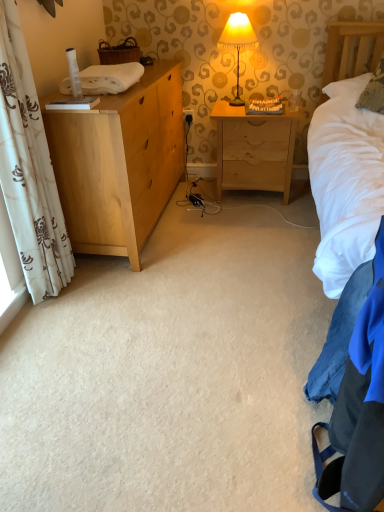
Question: Is light wood chest of drawers at left oriented away from textured beige pillow at upper right?

Choices:
 (A) yes
 (B) no

Answer: (B)

Question: Does light wood chest of drawers at left lie in front of textured beige pillow at upper right?

Choices:
 (A) yes
 (B) no

Answer: (A)

Question: Can you confirm if light wood chest of drawers at left is wider than textured beige pillow at upper right?

Choices:
 (A) yes
 (B) no

Answer: (A)

Question: Does light wood chest of drawers at left have a greater height compared to textured beige pillow at upper right?

Choices:
 (A) yes
 (B) no

Answer: (A)

Question: Is light wood chest of drawers at left in contact with textured beige pillow at upper right?

Choices:
 (A) yes
 (B) no

Answer: (B)

Question: Based on their sizes in the image, would you say yellow fabric lampshade at upper center is bigger or smaller than white floral fabric curtain at left?

Choices:
 (A) small
 (B) big

Answer: (A)

Question: Looking at their shapes, would you say yellow fabric lampshade at upper center is wider or thinner than white floral fabric curtain at left?

Choices:
 (A) wide
 (B) thin

Answer: (A)

Question: Considering their positions, is yellow fabric lampshade at upper center located in front of or behind white floral fabric curtain at left?

Choices:
 (A) front
 (B) behind

Answer: (B)

Question: Is point (228, 35) positioned closer to the camera than point (24, 166)?

Choices:
 (A) closer
 (B) farther

Answer: (B)

Question: Considering their positions, is yellow fabric lampshade at upper center located in front of or behind textured beige pillow at upper right?

Choices:
 (A) behind
 (B) front

Answer: (A)

Question: In terms of width, does yellow fabric lampshade at upper center look wider or thinner when compared to textured beige pillow at upper right?

Choices:
 (A) wide
 (B) thin

Answer: (B)

Question: From a real-world perspective, relative to textured beige pillow at upper right, is yellow fabric lampshade at upper center vertically above or below?

Choices:
 (A) above
 (B) below

Answer: (A)

Question: Considering the positions of yellow fabric lampshade at upper center and textured beige pillow at upper right in the image, is yellow fabric lampshade at upper center bigger or smaller than textured beige pillow at upper right?

Choices:
 (A) big
 (B) small

Answer: (B)

Question: Looking at the image, does yellow fabric lampshade at upper center seem bigger or smaller compared to white soft towel at left?

Choices:
 (A) big
 (B) small

Answer: (A)

Question: Would you say yellow fabric lampshade at upper center is to the left or to the right of white soft towel at left in the picture?

Choices:
 (A) right
 (B) left

Answer: (A)